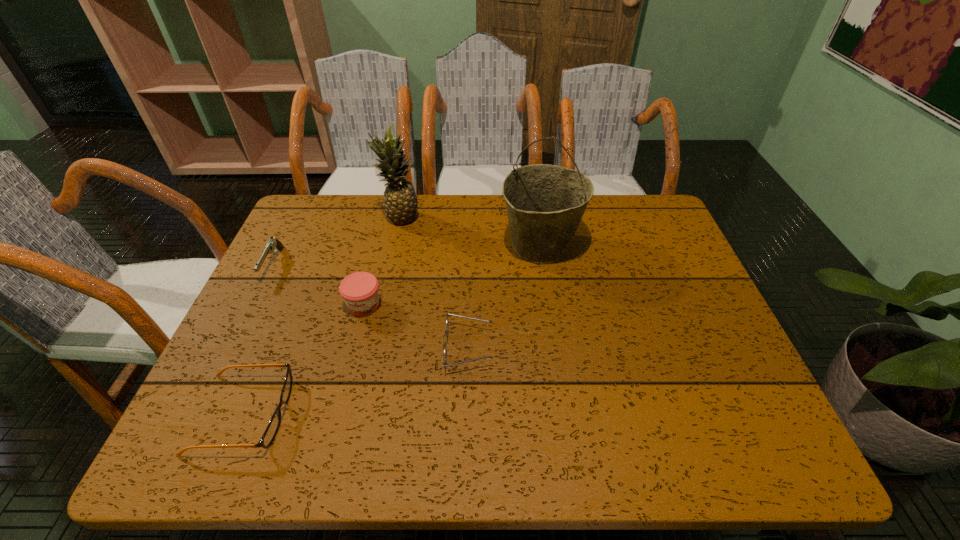
This screenshot has width=960, height=540. Find the location of `vacant space that's between the pineapple and the left spectacles`. vacant space that's between the pineapple and the left spectacles is located at coordinates (322, 316).

This screenshot has width=960, height=540. What are the coordinates of `unoccupied area between the left spectacles and the wine bucket` in the screenshot? It's located at (392, 330).

This screenshot has height=540, width=960. In order to click on vacant area that lies between the wine bucket and the second tallest object in this screenshot , I will do `click(470, 232)`.

I want to click on the third closest object to the fifth shortest object, so click(x=273, y=244).

Identify which object is the fourth nearest to the wine bucket. Please provide its 2D coordinates. Your answer should be formatted as a tuple, i.e. [(x, y)], where the tuple contains the x and y coordinates of a point satisfying the conditions above.

[(274, 424)]

Where is `free spot that satisfies the following two spatial constraints: 1. on the front side of the wine bucket; 2. on the front-facing side of the second object from right to left`? The image size is (960, 540). free spot that satisfies the following two spatial constraints: 1. on the front side of the wine bucket; 2. on the front-facing side of the second object from right to left is located at coordinates (557, 348).